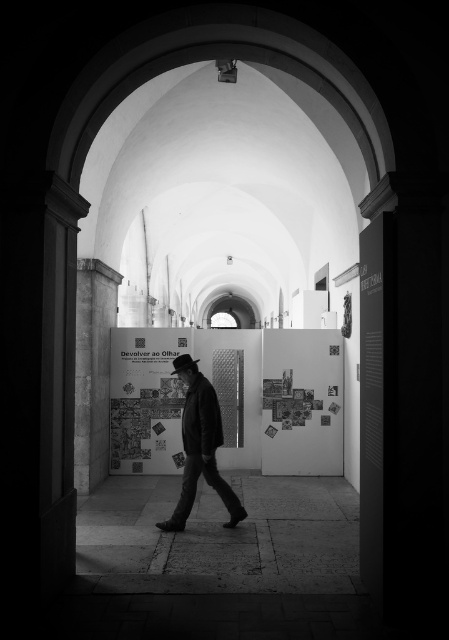
Question: Can you confirm if dark textured coat at center is positioned to the left of black felt fedora at center?

Choices:
 (A) no
 (B) yes

Answer: (A)

Question: Can you confirm if printed paper poster at center is positioned below black felt fedora at center?

Choices:
 (A) yes
 (B) no

Answer: (A)

Question: Which of the following is the farthest from the observer?

Choices:
 (A) black felt fedora at center
 (B) dark textured coat at center
 (C) printed paper poster at center
 (D) smooth stone pavement at center

Answer: (C)

Question: Which point is farther to the camera?

Choices:
 (A) (290, 486)
 (B) (176, 369)

Answer: (A)

Question: Is printed paper poster at center wider than dark textured coat at center?

Choices:
 (A) yes
 (B) no

Answer: (A)

Question: Among these points, which one is nearest to the camera?

Choices:
 (A) (186, 390)
 (B) (177, 362)

Answer: (A)